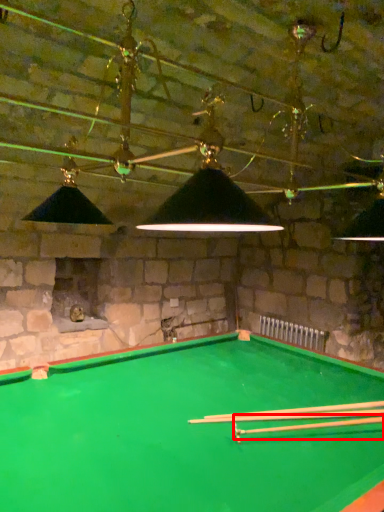
Question: From the image's perspective, where is cue (annotated by the red box) located in relation to cue in the image?

Choices:
 (A) below
 (B) above

Answer: (B)